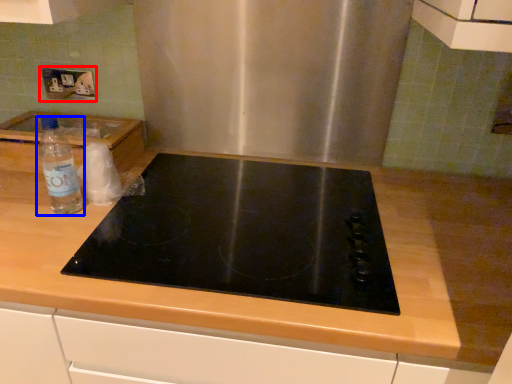
Question: Which object is further to the camera taking this photo, electric outlet (highlighted by a red box) or bottle (highlighted by a blue box)?

Choices:
 (A) electric outlet
 (B) bottle

Answer: (A)